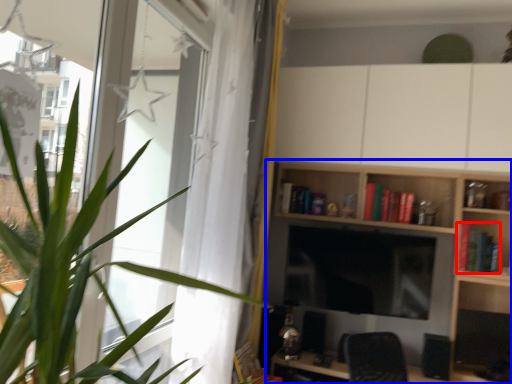
Question: Which object is further to the camera taking this photo, book (highlighted by a red box) or shelf (highlighted by a blue box)?

Choices:
 (A) book
 (B) shelf

Answer: (A)